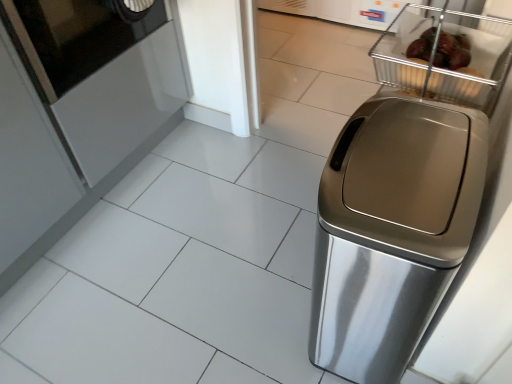
Question: Considering the relative sizes of metallic wire basket at upper right and satin silver trash can at right in the image provided, is metallic wire basket at upper right bigger than satin silver trash can at right?

Choices:
 (A) no
 (B) yes

Answer: (A)

Question: From a real-world perspective, is metallic wire basket at upper right physically below satin silver trash can at right?

Choices:
 (A) no
 (B) yes

Answer: (A)

Question: Considering the relative positions of metallic wire basket at upper right and satin silver trash can at right in the image provided, is metallic wire basket at upper right to the right of satin silver trash can at right from the viewer's perspective?

Choices:
 (A) yes
 (B) no

Answer: (A)

Question: Is metallic wire basket at upper right in front of satin silver trash can at right?

Choices:
 (A) yes
 (B) no

Answer: (B)

Question: Considering the relative positions of metallic wire basket at upper right and satin silver trash can at right in the image provided, is metallic wire basket at upper right to the left of satin silver trash can at right from the viewer's perspective?

Choices:
 (A) yes
 (B) no

Answer: (B)

Question: Do you think black glass screen door at upper left is within metallic wire basket at upper right, or outside of it?

Choices:
 (A) inside
 (B) outside

Answer: (B)

Question: Considering their positions, is black glass screen door at upper left located in front of or behind metallic wire basket at upper right?

Choices:
 (A) front
 (B) behind

Answer: (B)

Question: Considering the positions of black glass screen door at upper left and metallic wire basket at upper right in the image, is black glass screen door at upper left taller or shorter than metallic wire basket at upper right?

Choices:
 (A) short
 (B) tall

Answer: (B)

Question: Is point (22, 49) positioned closer to the camera than point (380, 72)?

Choices:
 (A) farther
 (B) closer

Answer: (A)

Question: Choose the correct answer: Is satin silver trash can at right inside black glass screen door at upper left or outside it?

Choices:
 (A) outside
 (B) inside

Answer: (A)

Question: From the image's perspective, relative to black glass screen door at upper left, is satin silver trash can at right above or below?

Choices:
 (A) above
 (B) below

Answer: (B)

Question: Does point (410, 9) appear closer or farther from the camera than point (38, 69)?

Choices:
 (A) closer
 (B) farther

Answer: (A)

Question: From their relative heights in the image, would you say satin silver trash can at right is taller or shorter than black glass screen door at upper left?

Choices:
 (A) short
 (B) tall

Answer: (B)

Question: Looking at the image, does metallic wire basket at upper right seem bigger or smaller compared to satin silver trash can at right?

Choices:
 (A) big
 (B) small

Answer: (B)

Question: From a real-world perspective, is metallic wire basket at upper right above or below satin silver trash can at right?

Choices:
 (A) above
 (B) below

Answer: (A)